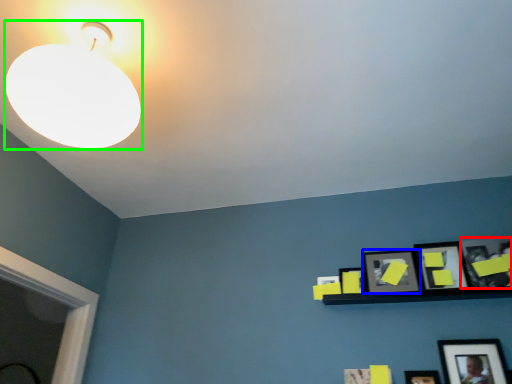
Question: Based on their relative distances, which object is nearer to picture frame (highlighted by a red box)? Choose from picture frame (highlighted by a blue box) and lamp (highlighted by a green box).

Choices:
 (A) picture frame
 (B) lamp

Answer: (A)